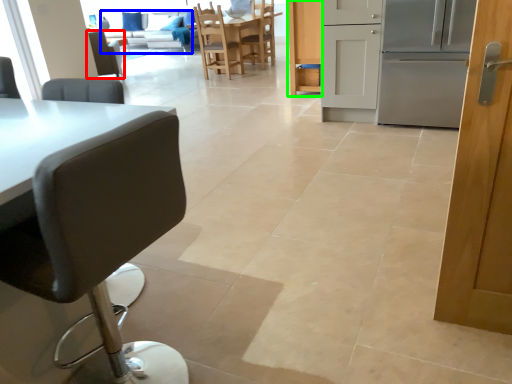
Question: Estimate the real-world distances between objects in this image. Which object is farther from chair (highlighted by a red box), couch (highlighted by a blue box) or cabinetry (highlighted by a green box)?

Choices:
 (A) couch
 (B) cabinetry

Answer: (B)